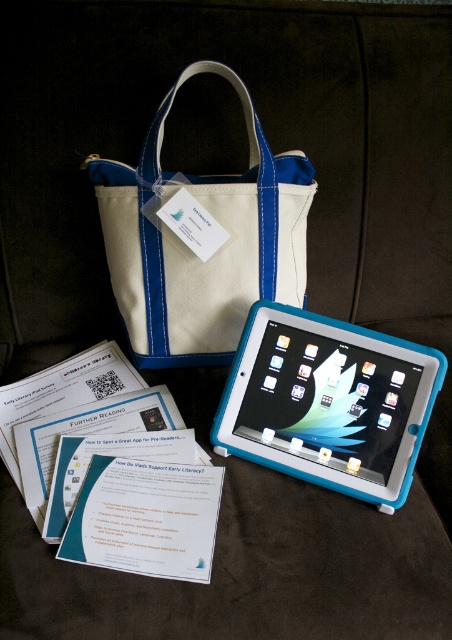
Question: Which point appears closest to the camera in this image?

Choices:
 (A) pos(103,218)
 (B) pos(391,364)

Answer: (B)

Question: Is the position of white canvas tote at upper center less distant than that of blue rubberized tablet at center?

Choices:
 (A) yes
 (B) no

Answer: (B)

Question: In this image, where is white canvas tote at upper center located relative to blue rubberized tablet at center?

Choices:
 (A) below
 (B) above

Answer: (B)

Question: Does white canvas tote at upper center have a lesser width compared to blue rubberized tablet at center?

Choices:
 (A) yes
 (B) no

Answer: (B)

Question: Among these objects, which one is farthest from the camera?

Choices:
 (A) blue rubberized tablet at center
 (B) white canvas tote at upper center

Answer: (B)

Question: Among these objects, which one is nearest to the camera?

Choices:
 (A) blue rubberized tablet at center
 (B) white canvas tote at upper center

Answer: (A)